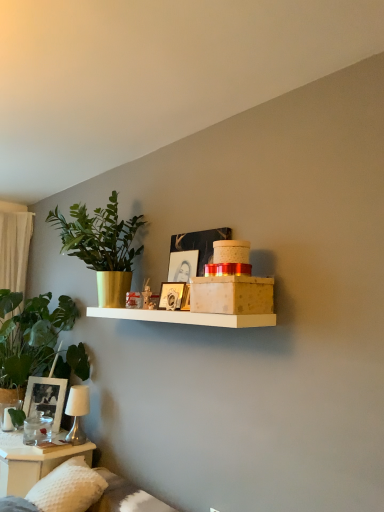
What do you see at coordinates (46, 398) in the screenshot?
I see `matte glass photo frame at lower left, placed as the second picture frame when sorted from right to left` at bounding box center [46, 398].

What is the approximate height of clear glass water at lower left?

It is 37.75 centimeters.

The image size is (384, 512). Describe the element at coordinates (68, 488) in the screenshot. I see `white textured pillow at lower left` at that location.

This screenshot has height=512, width=384. Find the location of `white textured pillow at lower left`. white textured pillow at lower left is located at coordinates point(68,488).

You are a GUI agent. You are given a task and a screenshot of the screen. Output one action in this format:
    pyautogui.click(x=<x>, y=<y>)
    Task: Click on the matte gold picture frame at center, which is the 1th picture frame in front-to-back order
    This screenshot has width=384, height=512.
    Given the screenshot: What is the action you would take?
    pyautogui.click(x=171, y=295)

From a real-world perspective, is matte glass photo frame at lower left, the 1th picture frame in the left-to-right sequence, beneath clear glass water at lower left?

No, from a real-world perspective, matte glass photo frame at lower left, the 1th picture frame in the left-to-right sequence, is not below clear glass water at lower left.

Is matte glass photo frame at lower left, which is counted as the first picture frame, starting from the back, in front of or behind clear glass water at lower left in the image?

matte glass photo frame at lower left, which is counted as the first picture frame, starting from the back, is behind clear glass water at lower left.

Does point (63, 389) come closer to viewer compared to point (86, 461)?

No, it is not.

Is matte glass photo frame at lower left, the first picture frame when ordered from bottom to top, at the left side of clear glass water at lower left?

In fact, matte glass photo frame at lower left, the first picture frame when ordered from bottom to top, is to the right of clear glass water at lower left.

Considering their positions, is green leafy plant at left, the second houseplant viewed from the top, located in front of or behind white textured pillow at lower left?

green leafy plant at left, the second houseplant viewed from the top, is positioned farther from the viewer than white textured pillow at lower left.

Considering the relative sizes of green leafy plant at left, which is the 1th houseplant from bottom to top, and white textured pillow at lower left in the image provided, is green leafy plant at left, which is the 1th houseplant from bottom to top, thinner than white textured pillow at lower left?

No.

Could you tell me if gold metallic pot at left, positioned as the 1th houseplant in top-to-bottom order, is facing matte gold picture frame at center, the 2th picture frame when ordered from back to front?

No.

How different are the orientations of gold metallic pot at left, positioned as the 1th houseplant in top-to-bottom order, and matte gold picture frame at center, which is the 1th picture frame in front-to-back order, in degrees?

The angle between the facing direction of gold metallic pot at left, positioned as the 1th houseplant in top-to-bottom order, and the facing direction of matte gold picture frame at center, which is the 1th picture frame in front-to-back order, is 20.2 degrees.

From the picture: Could matte gold picture frame at center, which is the 1th picture frame in front-to-back order, be considered to be inside gold metallic pot at left, positioned as the 1th houseplant in top-to-bottom order?

Actually, matte gold picture frame at center, which is the 1th picture frame in front-to-back order, is outside gold metallic pot at left, positioned as the 1th houseplant in top-to-bottom order.

Is gold metallic pot at left, the second houseplant positioned from the bottom, with matte gold picture frame at center, the 1th picture frame when ordered from right to left?

No, gold metallic pot at left, the second houseplant positioned from the bottom, is not next to matte gold picture frame at center, the 1th picture frame when ordered from right to left.

Is metallic silver table lamp at lower left positioned beyond the bounds of green leafy plant at left, the second houseplant viewed from the top?

Indeed, metallic silver table lamp at lower left is completely outside green leafy plant at left, the second houseplant viewed from the top.

Can you tell me how much metallic silver table lamp at lower left and green leafy plant at left, the second houseplant viewed from the top, differ in facing direction?

They differ by 0.000365 degrees in their facing directions.

From a real-world perspective, which houseplant is the 1st one above the metallic silver table lamp at lower left? Please provide its 2D coordinates.

[(30, 336)]

Is metallic silver table lamp at lower left in contact with green leafy plant at left, which is the 1th houseplant from bottom to top?

No, metallic silver table lamp at lower left is not touching green leafy plant at left, which is the 1th houseplant from bottom to top.

This screenshot has height=512, width=384. I want to click on picture frame above the metallic silver table lamp at lower left (from a real-world perspective), so click(171, 295).

From a real-world perspective, is metallic silver table lamp at lower left positioned under matte gold picture frame at center, positioned as the second picture frame in left-to-right order, based on gravity?

Yes.

Do you think metallic silver table lamp at lower left is within matte gold picture frame at center, which is the 1th picture frame in front-to-back order, or outside of it?

metallic silver table lamp at lower left is not inside matte gold picture frame at center, which is the 1th picture frame in front-to-back order, it's outside.

Considering the relative sizes of metallic silver table lamp at lower left and matte gold picture frame at center, which is the 1th picture frame in front-to-back order, in the image provided, is metallic silver table lamp at lower left bigger than matte gold picture frame at center, which is the 1th picture frame in front-to-back order,?

→ Correct, metallic silver table lamp at lower left is larger in size than matte gold picture frame at center, which is the 1th picture frame in front-to-back order.

In the scene shown: Is clear glass water at lower left inside metallic silver table lamp at lower left?

No, metallic silver table lamp at lower left does not contain clear glass water at lower left.

Is metallic silver table lamp at lower left aimed at clear glass water at lower left?

No, metallic silver table lamp at lower left is not aimed at clear glass water at lower left.

From the image's perspective, is metallic silver table lamp at lower left located beneath clear glass water at lower left?

No.

Could you tell me if metallic silver table lamp at lower left is turned towards gold metallic pot at left, positioned as the 1th houseplant in top-to-bottom order?

No, metallic silver table lamp at lower left does not turn towards gold metallic pot at left, positioned as the 1th houseplant in top-to-bottom order.

From a real-world perspective, who is located higher, metallic silver table lamp at lower left or gold metallic pot at left, the second houseplant positioned from the bottom?

gold metallic pot at left, the second houseplant positioned from the bottom.

Can you confirm if metallic silver table lamp at lower left is wider than gold metallic pot at left, positioned as the 1th houseplant in top-to-bottom order?

In fact, metallic silver table lamp at lower left might be narrower than gold metallic pot at left, positioned as the 1th houseplant in top-to-bottom order.

Does metallic silver table lamp at lower left lie in front of gold metallic pot at left, the second houseplant positioned from the bottom?

No, it is behind gold metallic pot at left, the second houseplant positioned from the bottom.

At what (x,y) coordinates should I click in order to perform the action: click on picture frame that is the 1st one when counting rightward from the clear glass water at lower left. Please return your answer as a coordinate pair (x, y). Image resolution: width=384 pixels, height=512 pixels. Looking at the image, I should click on (46, 398).

In order to click on houseplant behind the white textured pillow at lower left in this screenshot , I will do `click(30, 336)`.

From the image, which object appears to be farther from gold metallic pot at left, the second houseplant positioned from the bottom, metallic silver table lamp at lower left or white textured pillow at lower left?

white textured pillow at lower left lies further to gold metallic pot at left, the second houseplant positioned from the bottom, than the other object.

Considering their positions, is white textured pillow at lower left positioned closer to matte gold picture frame at center, positioned as the second picture frame in left-to-right order, than clear glass water at lower left?

Based on the image, white textured pillow at lower left appears to be nearer to matte gold picture frame at center, positioned as the second picture frame in left-to-right order.

Estimate the real-world distances between objects in this image. Which object is further from gold metallic pot at left, the second houseplant positioned from the bottom, green leafy plant at left, which is the 1th houseplant from bottom to top, or matte gold picture frame at center, positioned as the first picture frame in top-to-bottom order?

green leafy plant at left, which is the 1th houseplant from bottom to top, is positioned further to the anchor gold metallic pot at left, the second houseplant positioned from the bottom.

Considering their positions, is green leafy plant at left, which is the 1th houseplant from bottom to top, positioned closer to white textured pillow at lower left than matte glass photo frame at lower left, arranged as the second picture frame when viewed from the front?

The object closer to white textured pillow at lower left is matte glass photo frame at lower left, arranged as the second picture frame when viewed from the front.

From the image, which object appears to be nearer to metallic silver table lamp at lower left, matte glass photo frame at lower left, the first picture frame when ordered from bottom to top, or green leafy plant at left, the second houseplant viewed from the top?

The object closer to metallic silver table lamp at lower left is matte glass photo frame at lower left, the first picture frame when ordered from bottom to top.

Estimate the real-world distances between objects in this image. Which object is further from metallic silver table lamp at lower left, green leafy plant at left, the second houseplant viewed from the top, or white textured pillow at lower left?

green leafy plant at left, the second houseplant viewed from the top.

Estimate the real-world distances between objects in this image. Which object is further from matte gold picture frame at center, positioned as the second picture frame in left-to-right order, matte glass photo frame at lower left, the first picture frame when ordered from bottom to top, or green leafy plant at left, the second houseplant viewed from the top?

matte glass photo frame at lower left, the first picture frame when ordered from bottom to top, lies further to matte gold picture frame at center, positioned as the second picture frame in left-to-right order, than the other object.

Looking at the image, which one is located closer to clear glass water at lower left, green leafy plant at left, which is the 1th houseplant from bottom to top, or matte gold picture frame at center, positioned as the second picture frame in left-to-right order?

Among the two, green leafy plant at left, which is the 1th houseplant from bottom to top, is located nearer to clear glass water at lower left.

The height and width of the screenshot is (512, 384). What are the coordinates of `houseplant that lies between gold metallic pot at left, the second houseplant positioned from the bottom, and clear glass water at lower left from top to bottom` in the screenshot? It's located at (30, 336).

What are the coordinates of `table lamp between matte gold picture frame at center, positioned as the second picture frame in left-to-right order, and clear glass water at lower left, in the vertical direction` in the screenshot? It's located at (77, 412).

The height and width of the screenshot is (512, 384). Find the location of `table lamp that lies between gold metallic pot at left, positioned as the 1th houseplant in top-to-bottom order, and clear glass water at lower left from top to bottom`. table lamp that lies between gold metallic pot at left, positioned as the 1th houseplant in top-to-bottom order, and clear glass water at lower left from top to bottom is located at coordinates (77, 412).

Where is `table lamp between gold metallic pot at left, the second houseplant positioned from the bottom, and white textured pillow at lower left from top to bottom`? table lamp between gold metallic pot at left, the second houseplant positioned from the bottom, and white textured pillow at lower left from top to bottom is located at coordinates (77, 412).